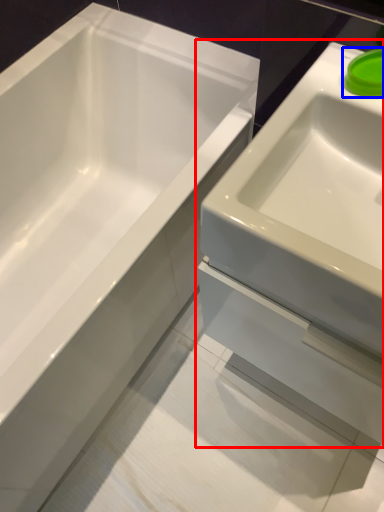
Question: Which point is closer to the camera, sink (highlighted by a red box) or liquid (highlighted by a blue box)?

Choices:
 (A) sink
 (B) liquid

Answer: (A)